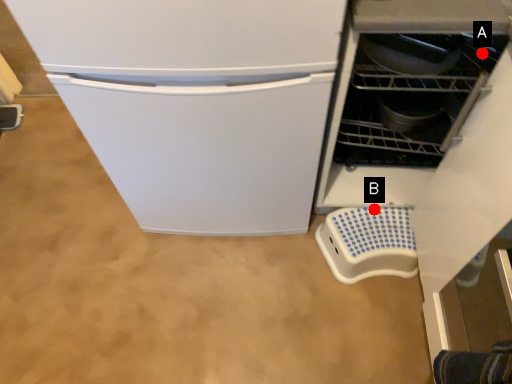
Question: Two points are circled on the image, labeled by A and B beside each circle. Which of the following is the farthest from the observer?

Choices:
 (A) A is further
 (B) B is further

Answer: (B)